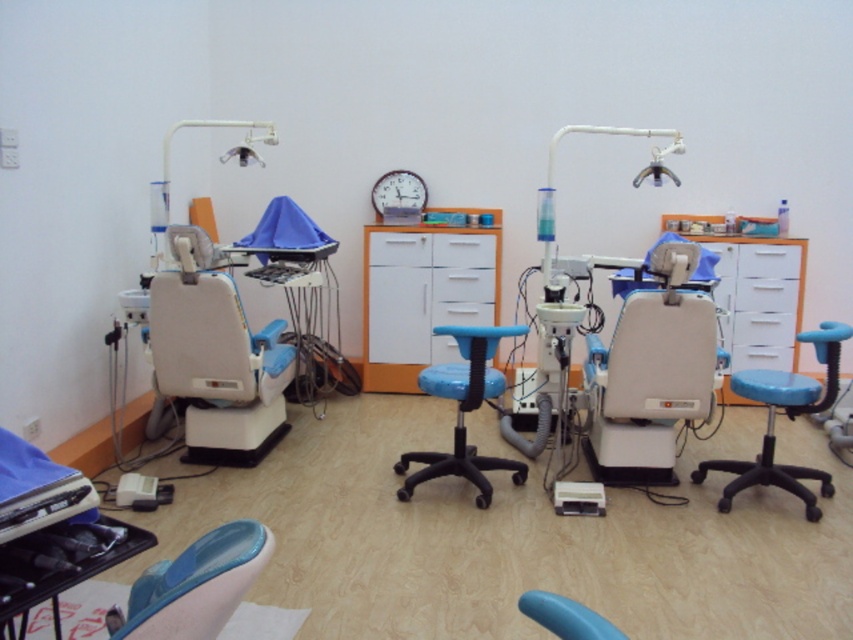
Question: Can you confirm if translucent blue swivel chair at lower left is positioned below blue plastic chair at lower center?

Choices:
 (A) yes
 (B) no

Answer: (A)

Question: Can you confirm if white glossy file cabinet at center is wider than blue plastic stool at center?

Choices:
 (A) yes
 (B) no

Answer: (A)

Question: Which point is closer to the camera?

Choices:
 (A) (498, 298)
 (B) (262, 536)
 (C) (210, 419)
 (D) (752, 320)

Answer: (B)

Question: Which object is farther from the camera taking this photo?

Choices:
 (A) blue fabric stool at center
 (B) blue plastic chair at lower center
 (C) white glossy file cabinet at center
 (D) white glossy cabinet at center

Answer: (D)

Question: Is white glossy cabinet at center thinner than blue plastic stool at center?

Choices:
 (A) no
 (B) yes

Answer: (A)

Question: Which of the following is the farthest from the observer?

Choices:
 (A) (167, 570)
 (B) (572, 618)
 (C) (463, 385)

Answer: (C)